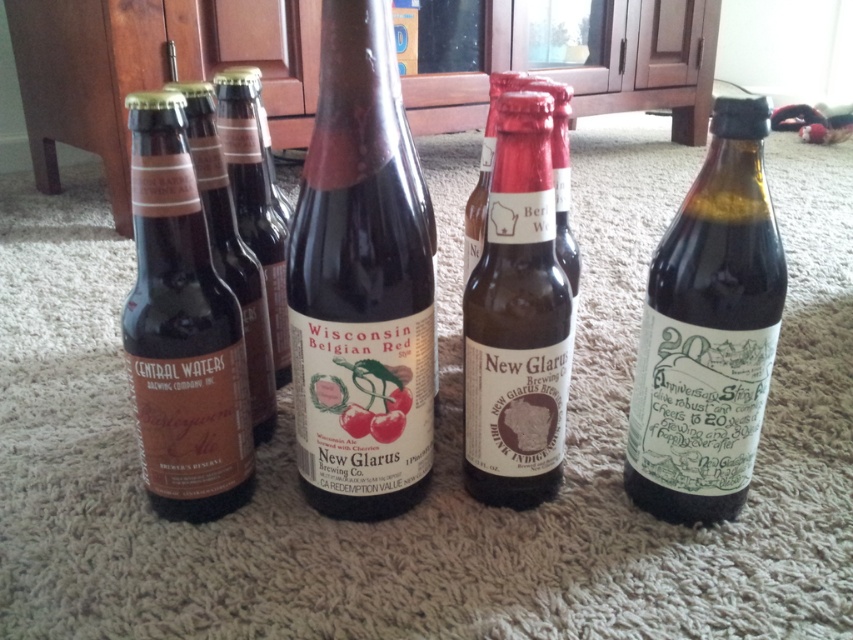
Is brown matte glass bottle at center further to camera compared to matte brown bottle at center?

No, it is not.

Is point (477, 289) farther from viewer compared to point (485, 160)?

No, (477, 289) is in front of (485, 160).

What do you see at coordinates (515, 321) in the screenshot? I see `brown matte glass bottle at center` at bounding box center [515, 321].

Where is `brown matte glass bottle at center`? The height and width of the screenshot is (640, 853). brown matte glass bottle at center is located at coordinates (515, 321).

Can you confirm if green glass bottle at right is positioned to the left of matte brown bottle at center?

Incorrect, green glass bottle at right is not on the left side of matte brown bottle at center.

Who is positioned more to the right, green glass bottle at right or matte brown bottle at center?

green glass bottle at right

The image size is (853, 640). Describe the element at coordinates (708, 332) in the screenshot. I see `green glass bottle at right` at that location.

Locate an element on the screen. green glass bottle at right is located at coordinates (708, 332).

Is matte brown glass beer bottle at left smaller than matte brown glass bottle at left?

Actually, matte brown glass beer bottle at left might be larger than matte brown glass bottle at left.

Between matte brown glass beer bottle at left and matte brown glass bottle at left, which one appears on the right side from the viewer's perspective?

matte brown glass bottle at left

Locate an element on the screen. Image resolution: width=853 pixels, height=640 pixels. matte brown glass beer bottle at left is located at coordinates (181, 330).

This screenshot has height=640, width=853. What are the coordinates of `matte brown glass beer bottle at left` in the screenshot? It's located at (181, 330).